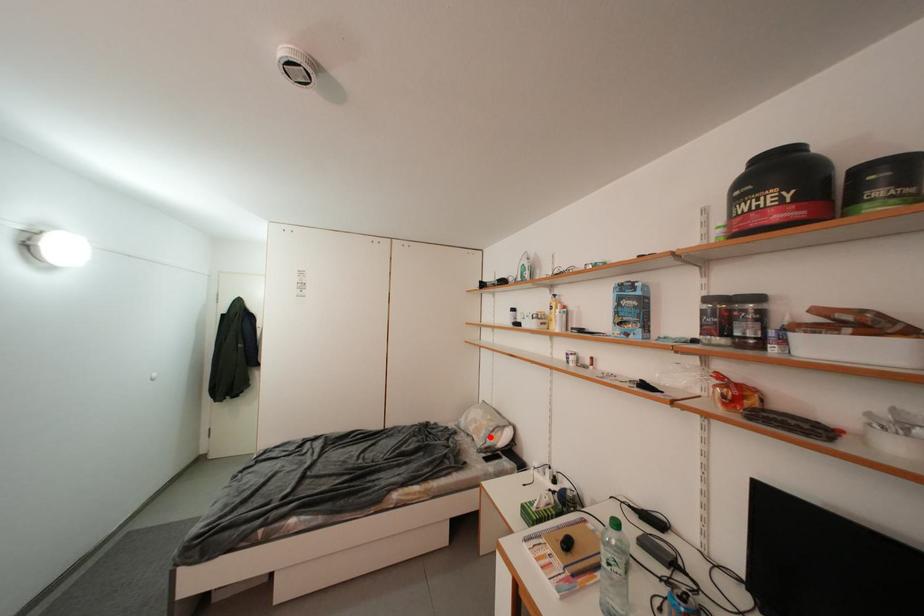
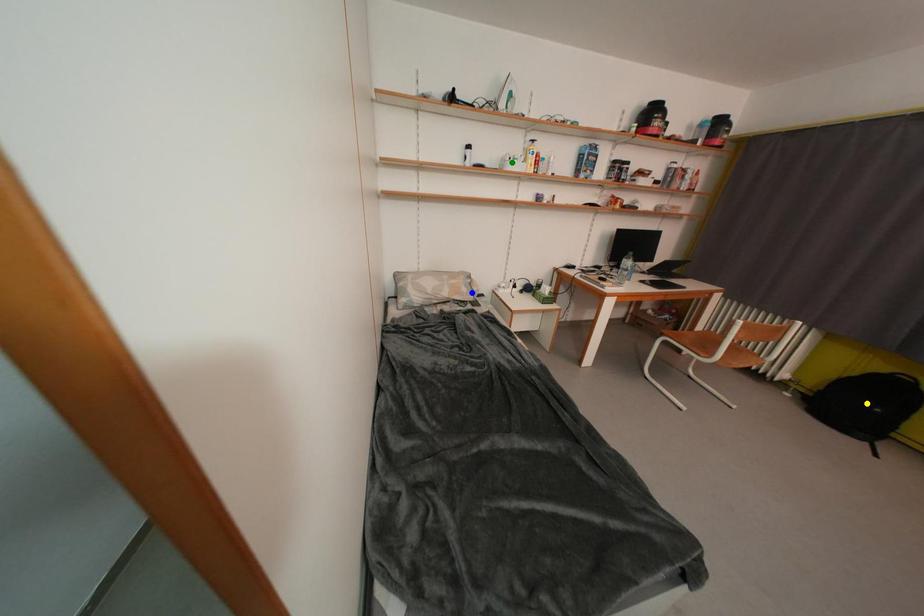
Question: I am providing you with two images of the same scene from different viewpoints. A red point is marked on the first image. You are given multiple points on the second image. Which point in image 2 is actually the same real-world point as the red point in image 1?

Choices:
 (A) green point
 (B) blue point
 (C) yellow point

Answer: (B)